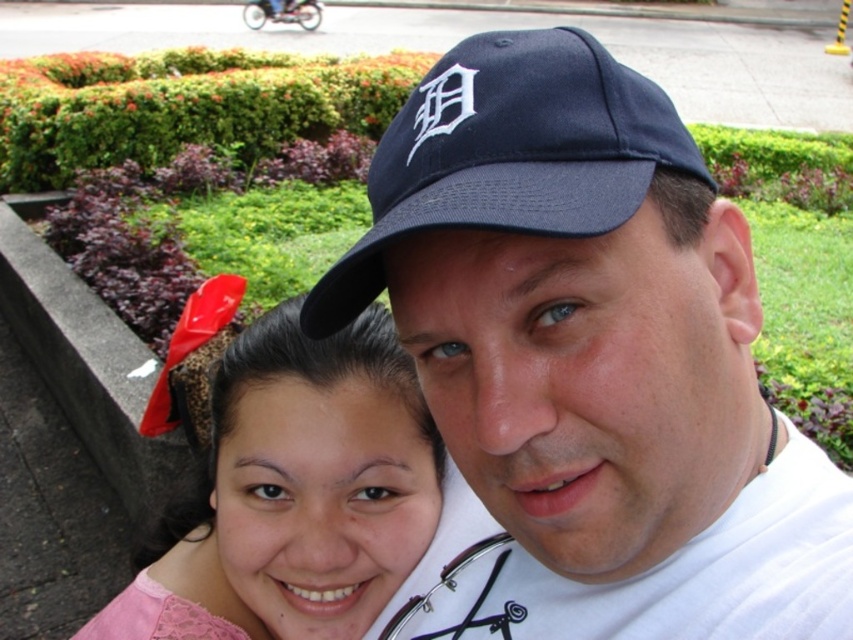
You are a photographer trying to capture a closeup of both the pink lace hairband at upper left and the navy blue fabric baseball cap at center. Given that your camera can only focus on objects within a 10cm width, will you need to adjust your framing to ensure both fit within the focus area?

The pink lace hairband at upper left is wider than the navy blue fabric baseball cap at center. Since the camera requires a focus area of 10cm, you should check the actual widths of both objects to confirm if their combined width exceeds the limit. However, the description only states the comparison between their widths, not exact measurements. Without specific dimensions, it is uncertain if they will fit within the 10cm focus area.

Based on the photo, based on the scene description, where exactly is the navy blue baseball cap at upper center located in the image?

The navy blue baseball cap at upper center is located at point coordinates of (x=590, y=358).

You are a photographer trying to capture a closeup of the pink lace hairband at upper left. Based on the scene description, where would you focus your camera? Please provide coordinates in the format of x,y between 0 and 1.

The pink lace hairband at upper left is located at coordinates [300,486]. Focus your camera there.